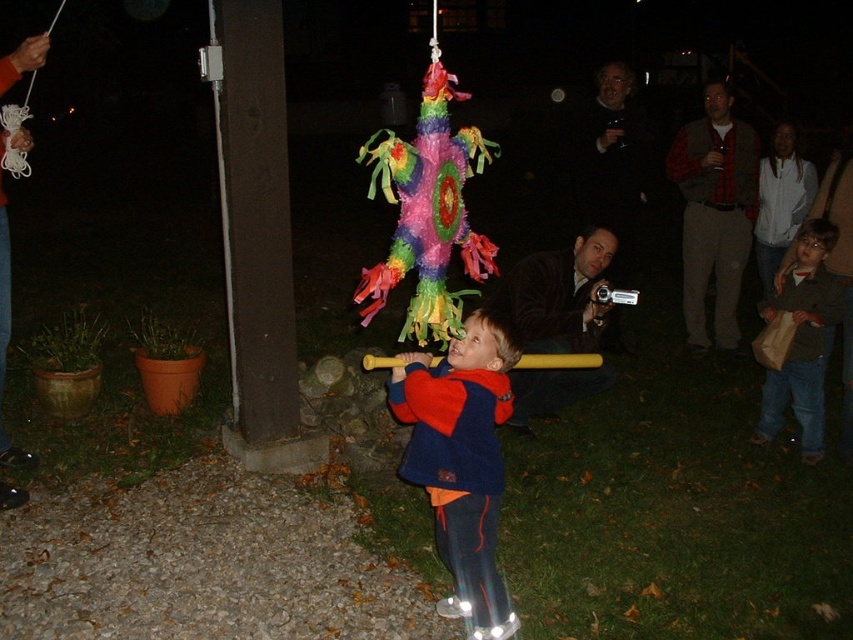
You are at a party and want to grab the brown paper bag at lower right to collect candy. However, there is an adult wearing a red plaid shirt at upper right in the way. Can you reach the bag without moving the adult?

The brown paper bag at lower right is behind the red plaid shirt at upper right, so you can reach it without moving the adult by going around or behind them.

You are at a party and need to find the closest jacket to you. You see a dark brown leather jacket at center and a white fleece jacket at upper right. Which jacket is closer to you?

The dark brown leather jacket at center is closer to the viewer than the white fleece jacket at upper right, so the dark brown leather jacket at center is the closest one to you.